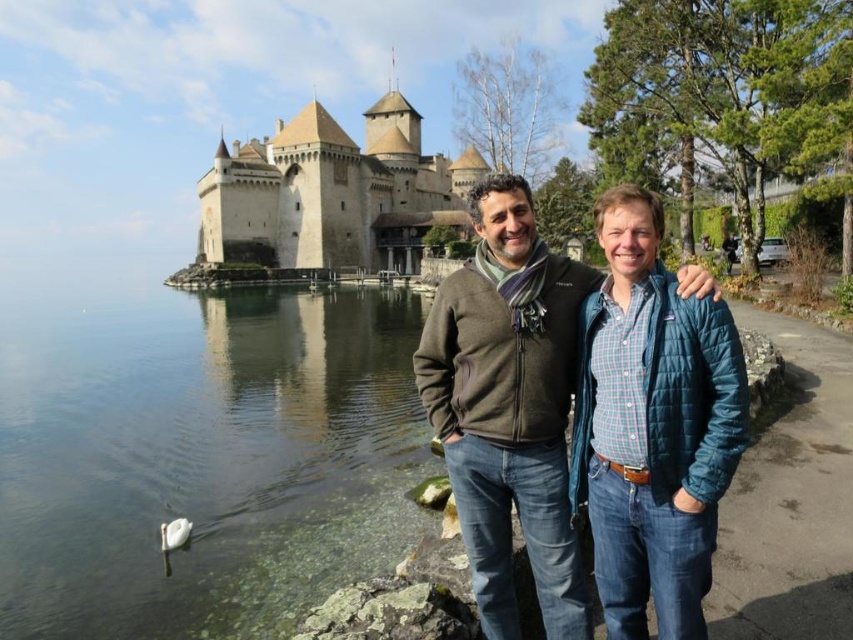
Who is higher up, teal quilted jacket at center or matte brown jacket at center?

matte brown jacket at center is higher up.

Does point (598, 544) lie behind point (712, 481)?

Yes, point (598, 544) is behind point (712, 481).

Which is in front, point (630, 342) or point (431, 416)?

Point (630, 342) is more forward.

The width and height of the screenshot is (853, 640). Identify the location of teal quilted jacket at center. (653, 426).

Does clear water at lake left have a greater height compared to matte brown jacket at center?

No, clear water at lake left is not taller than matte brown jacket at center.

Is clear water at lake left bigger than matte brown jacket at center?

Indeed, clear water at lake left has a larger size compared to matte brown jacket at center.

Between point (26, 426) and point (721, 417), which one is positioned behind?

The point (26, 426) is behind.

Where is `clear water at lake left`? This screenshot has width=853, height=640. clear water at lake left is located at coordinates (202, 458).

Can you confirm if stone medieval castle at upper center is smaller than white matte swan at lower left?

Incorrect, stone medieval castle at upper center is not smaller in size than white matte swan at lower left.

Which is below, stone medieval castle at upper center or white matte swan at lower left?

white matte swan at lower left

What do you see at coordinates (332, 193) in the screenshot? The image size is (853, 640). I see `stone medieval castle at upper center` at bounding box center [332, 193].

This screenshot has width=853, height=640. Find the location of `stone medieval castle at upper center`. stone medieval castle at upper center is located at coordinates (332, 193).